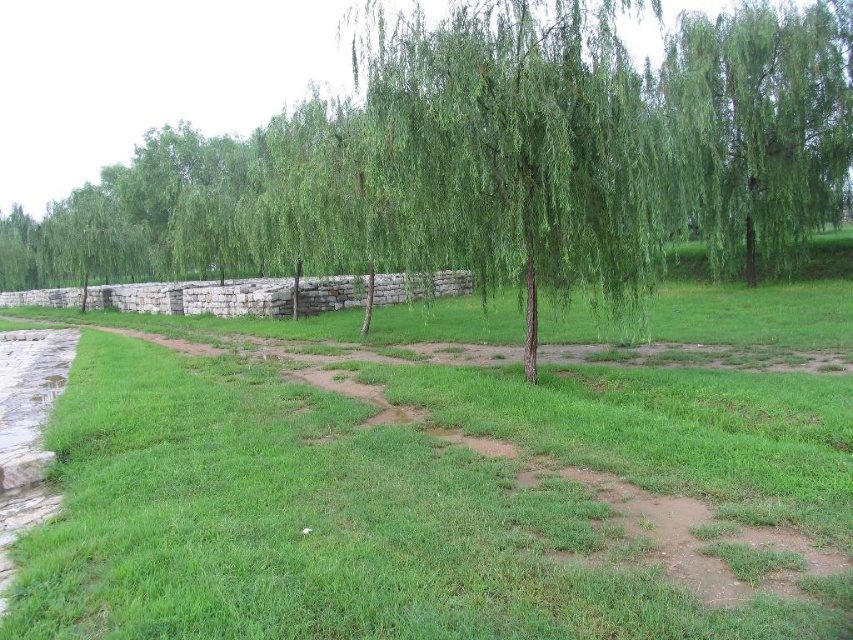
Question: Does green leafy tree at center appear on the right side of green leafy willow at center?

Choices:
 (A) no
 (B) yes

Answer: (A)

Question: Which object appears closest to the camera in this image?

Choices:
 (A) green leafy tree at center
 (B) green leafy willow at upper right
 (C) green leafy willow at center

Answer: (C)

Question: Which of the following is the closest to the observer?

Choices:
 (A) green grassy at center
 (B) green leafy willow at upper right
 (C) green leafy tree at center

Answer: (A)

Question: Which point is closer to the camera?

Choices:
 (A) (68, 234)
 (B) (799, 173)
 (C) (627, 550)

Answer: (C)

Question: Can you confirm if green leafy tree at center is positioned below green leafy willow at upper right?

Choices:
 (A) yes
 (B) no

Answer: (B)

Question: Does green grassy at center appear on the left side of green leafy willow at center?

Choices:
 (A) no
 (B) yes

Answer: (B)